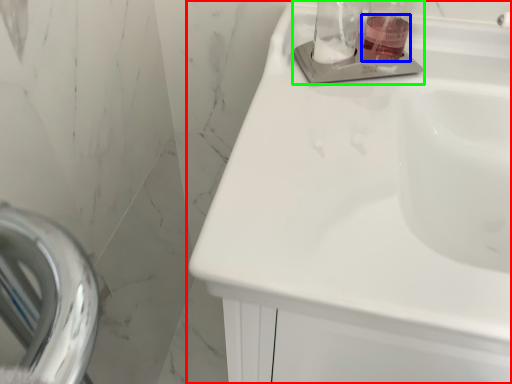
Question: Which object is the farthest from sink (highlighted by a red box)? Choose among these: liquid (highlighted by a blue box) or sink (highlighted by a green box).

Choices:
 (A) liquid
 (B) sink

Answer: (A)